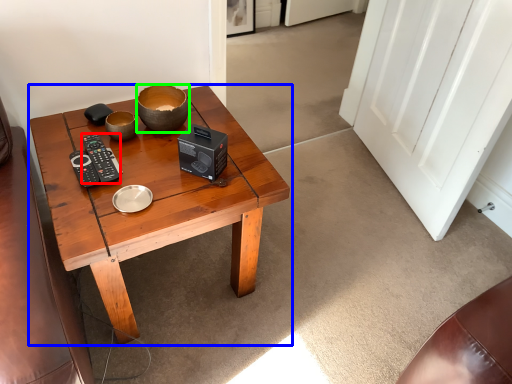
Question: Which is farther away from control (highlighted by a red box)? coffee table (highlighted by a blue box) or bowl (highlighted by a green box)?

Choices:
 (A) coffee table
 (B) bowl

Answer: (A)